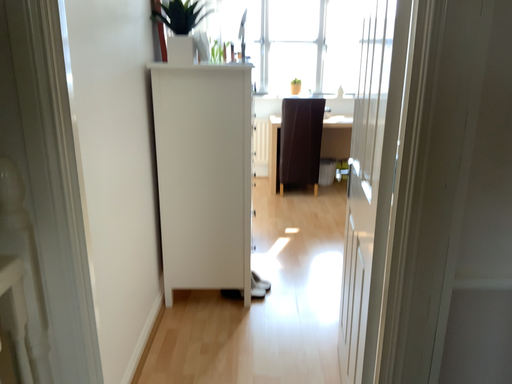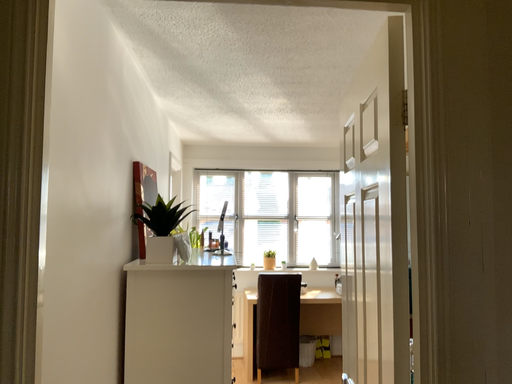
Question: How did the camera likely rotate when shooting the video?

Choices:
 (A) rotated upward
 (B) rotated downward

Answer: (A)